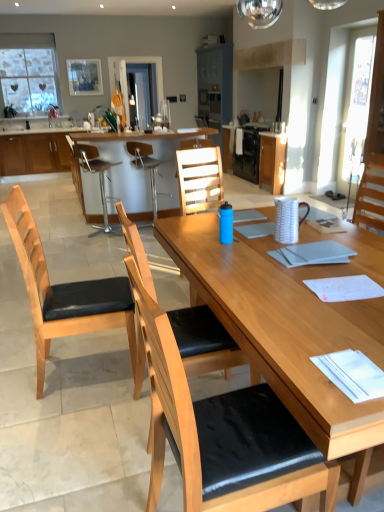
Question: From the image's perspective, is wooden cabinet at center, marked as the first cabinetry in a right-to-left arrangement, located above or below wooden cabinet at left, which is the 3th cabinetry from right to left?

Choices:
 (A) above
 (B) below

Answer: (B)

Question: Visually, is wooden cabinet at center, marked as the first cabinetry in a right-to-left arrangement, positioned to the left or to the right of wooden cabinet at left, placed as the 1th cabinetry when sorted from left to right?

Choices:
 (A) left
 (B) right

Answer: (B)

Question: Which object is positioned closest to the wooden cabinet at left, placed as the 1th cabinetry when sorted from left to right?

Choices:
 (A) wooden chair with black cushion at center, which is counted as the 2th chair, starting from the front
 (B) wooden chair with black cushion at center, which is the fifth chair in back-to-front order
 (C) wooden table at center
 (D) matte wood cabinet at center, the second cabinetry viewed from the left
 (E) brown leather bar stool at center, the 2th chair when ordered from back to front

Answer: (E)

Question: Which of these objects is positioned farthest from the matte wood cabinet at center, the second cabinetry viewed from the left?

Choices:
 (A) wooden chair with black cushion at center, which is the fifth chair in back-to-front order
 (B) wooden table at center
 (C) wooden cabinet at left, placed as the 1th cabinetry when sorted from left to right
 (D) light brown wood chair at center, the 1th chair when ordered from back to front
 (E) wooden chair with black cushion at center, marked as the fourth chair in a back-to-front arrangement

Answer: (A)